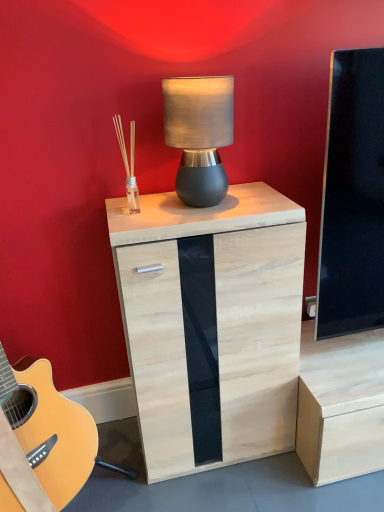
The height and width of the screenshot is (512, 384). Identify the location of vacant space in matte gray lamp at center (from a real-world perspective). (217, 200).